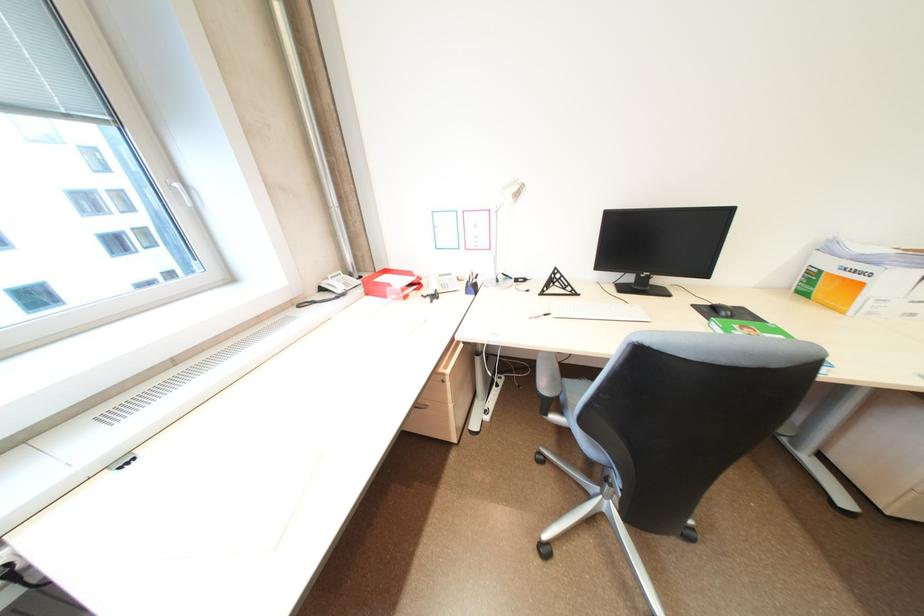
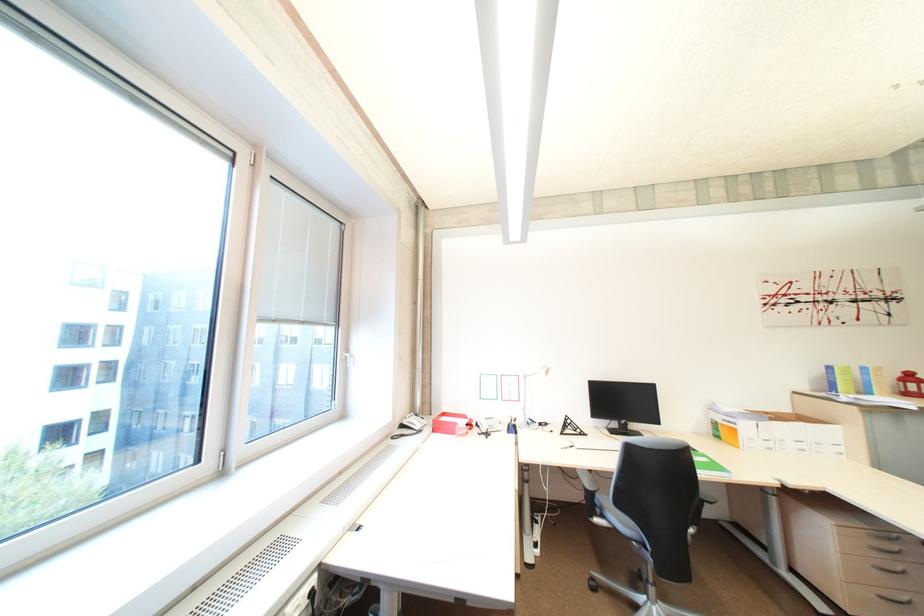
Where in the second image is the point corresponding to point 395,272 from the first image?

(454, 415)